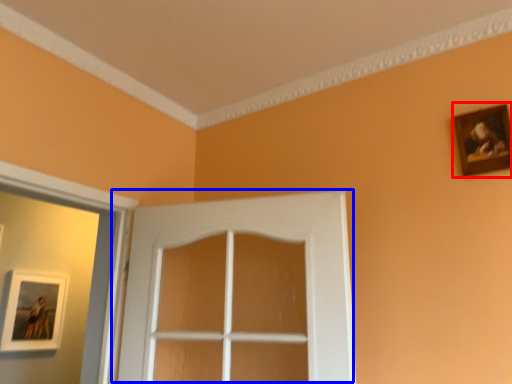
Question: Which object is further to the camera taking this photo, picture frame (highlighted by a red box) or door (highlighted by a blue box)?

Choices:
 (A) picture frame
 (B) door

Answer: (A)